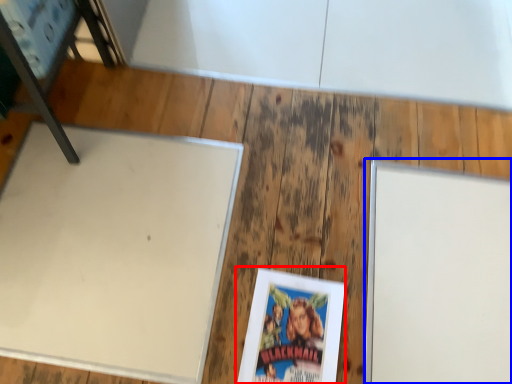
Question: Which of the following is the closest to the observer, paperback book (highlighted by a red box) or bulletin board (highlighted by a blue box)?

Choices:
 (A) paperback book
 (B) bulletin board

Answer: (A)